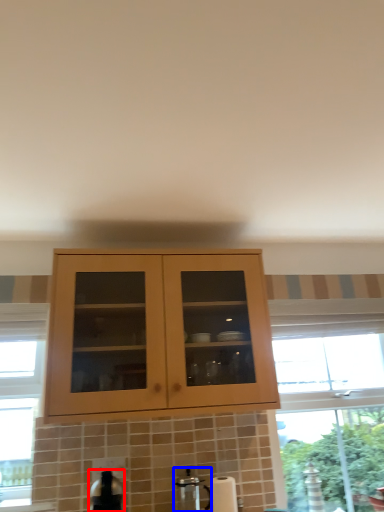
Question: Which object appears closest to the camera in this image, appliance (highlighted by a red box) or coffee machine (highlighted by a blue box)?

Choices:
 (A) appliance
 (B) coffee machine

Answer: (A)